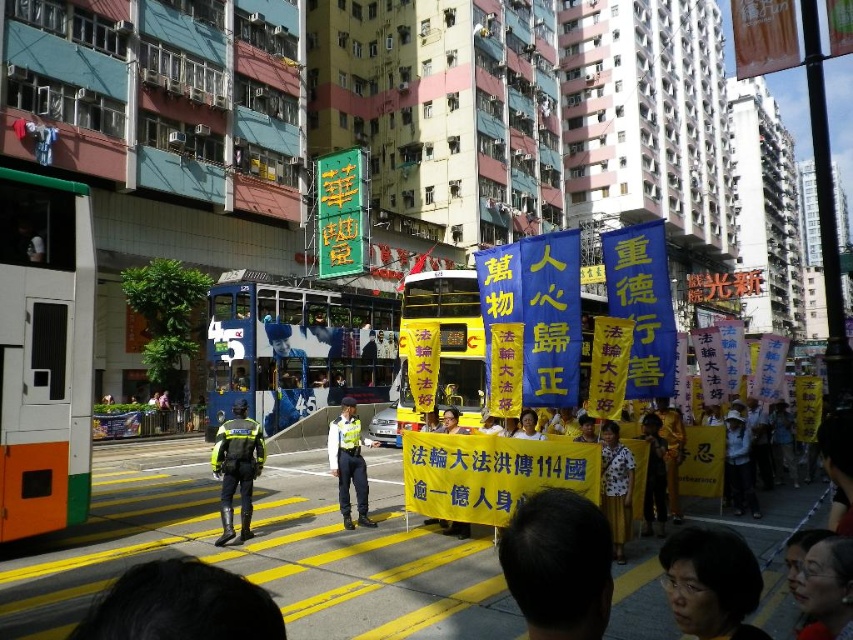
Question: Observing the image, what is the correct spatial positioning of yellowtextured fabricdoubled-decker bus at center in reference to matte black hair at lower center?

Choices:
 (A) below
 (B) above

Answer: (B)

Question: Which point appears closest to the camera in this image?

Choices:
 (A) (799, 586)
 (B) (401, 323)
 (C) (80, 424)

Answer: (A)

Question: Which of these objects is positioned farthest from the orange and white bus at left?

Choices:
 (A) yellow fabric/decorative at center
 (B) yellowtextured fabricdoubled-decker bus at center

Answer: (A)

Question: Can you confirm if black hair at center is positioned above reflective yellow jacket at center?

Choices:
 (A) no
 (B) yes

Answer: (B)

Question: Can you confirm if orange and white bus at left is positioned to the left of yellow floral blouse at center?

Choices:
 (A) no
 (B) yes

Answer: (B)

Question: Which point is farther to the camera?

Choices:
 (A) (676, 582)
 (B) (329, 445)
 (C) (398, 384)

Answer: (C)